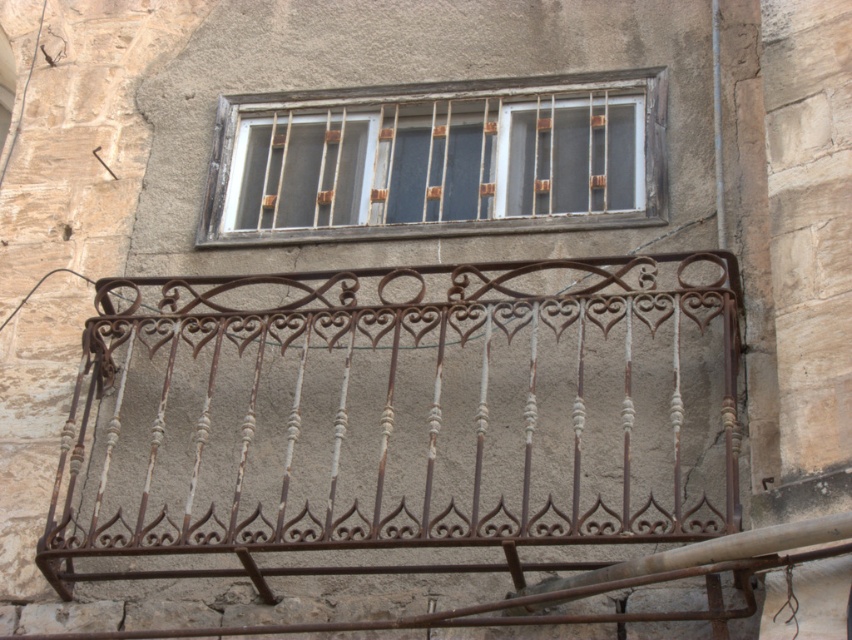
Who is positioned more to the left, rusty wrought iron balcony at center or wooden bars at upper center?

rusty wrought iron balcony at center

Is rusty wrought iron balcony at center in front of wooden bars at upper center?

Yes, it is in front of wooden bars at upper center.

Find the location of a particular element. The image size is (852, 640). rusty wrought iron balcony at center is located at coordinates (400, 412).

At what (x,y) coordinates should I click in order to perform the action: click on rusty wrought iron balcony at center. Please return your answer as a coordinate pair (x, y). The height and width of the screenshot is (640, 852). Looking at the image, I should click on (400, 412).